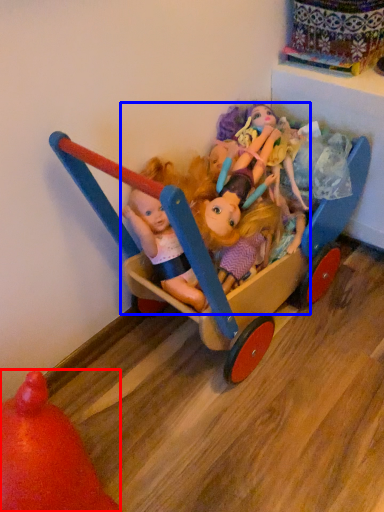
Question: Which object appears closest to the camera in this image, toy (highlighted by a red box) or doll (highlighted by a blue box)?

Choices:
 (A) toy
 (B) doll

Answer: (A)